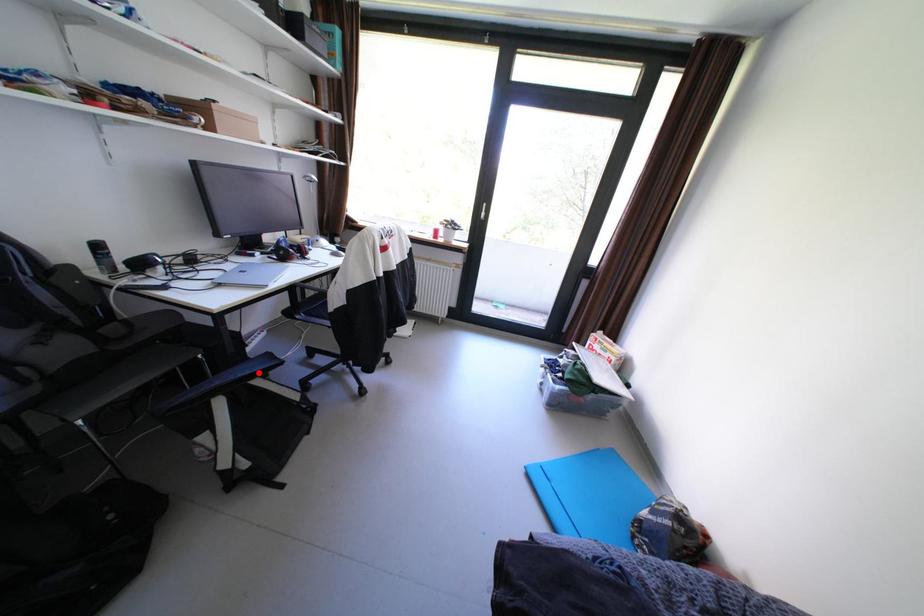
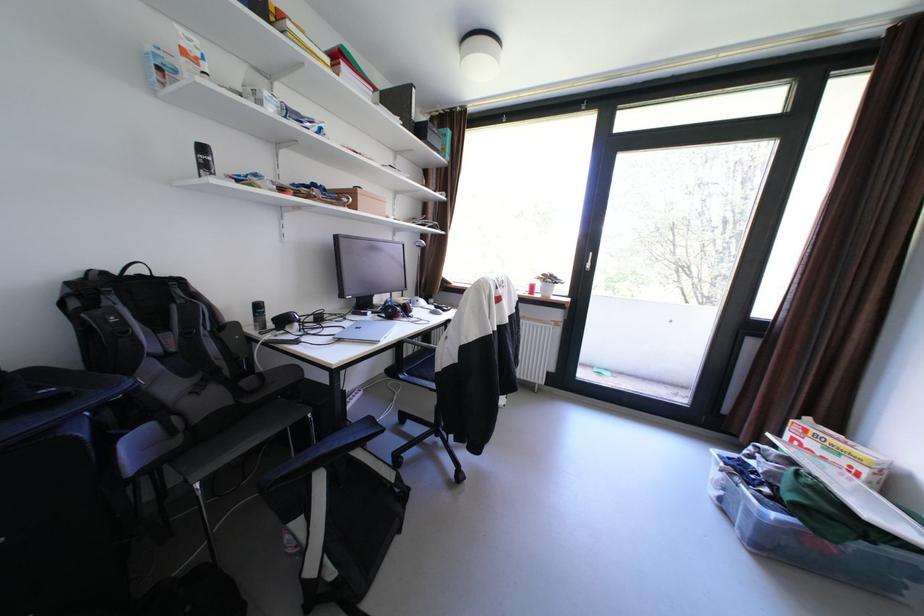
In the second image, find the point that corresponds to the highlighted location in the first image.

(361, 440)